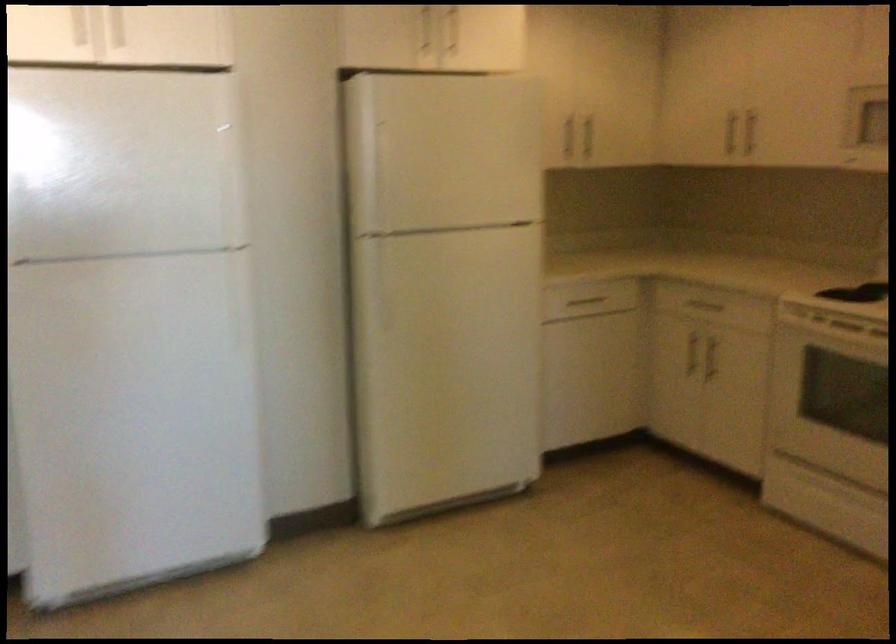
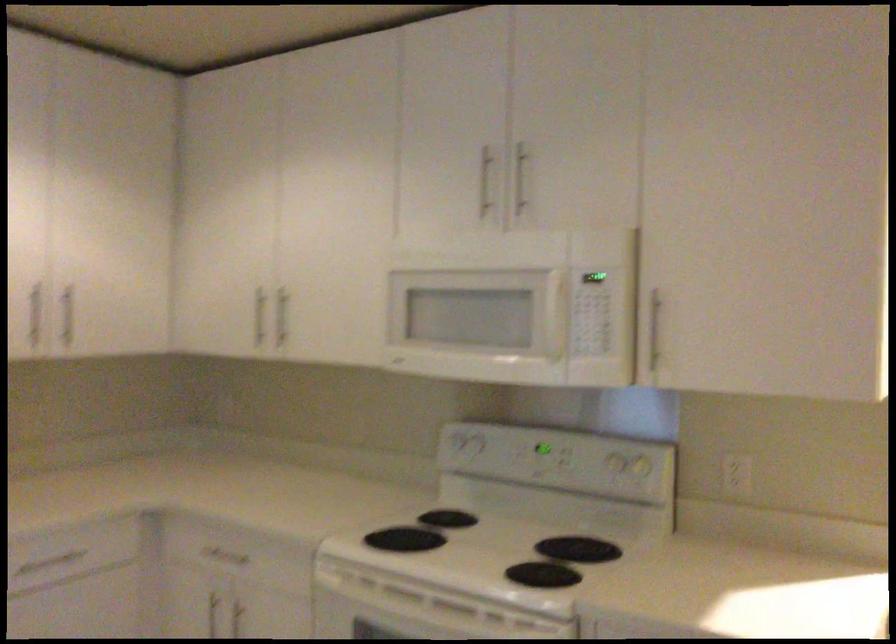
Question: Based on the continuous images, in which direction is the camera rotating? Reply with the corresponding letter.

Choices:
 (A) Left
 (B) Right
 (C) Up
 (D) Down

Answer: (B)